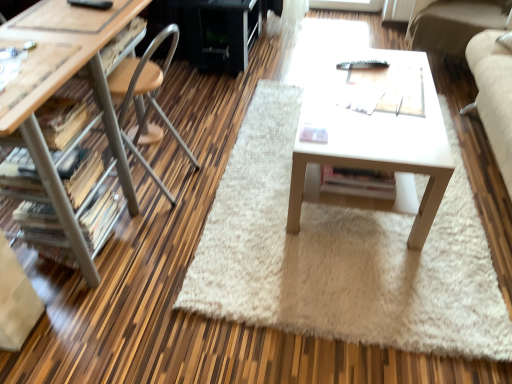
Question: Considering the relative positions of wooden drawer at left and white shaggy rug at center in the image provided, is wooden drawer at left behind white shaggy rug at center?

Choices:
 (A) yes
 (B) no

Answer: (A)

Question: Would you consider wooden drawer at left to be distant from white shaggy rug at center?

Choices:
 (A) yes
 (B) no

Answer: (A)

Question: Considering the relative sizes of wooden drawer at left and white shaggy rug at center in the image provided, is wooden drawer at left wider than white shaggy rug at center?

Choices:
 (A) no
 (B) yes

Answer: (A)

Question: From a real-world perspective, is wooden drawer at left under white shaggy rug at center?

Choices:
 (A) no
 (B) yes

Answer: (A)

Question: Considering the relative sizes of wooden drawer at left and white shaggy rug at center in the image provided, is wooden drawer at left smaller than white shaggy rug at center?

Choices:
 (A) no
 (B) yes

Answer: (B)

Question: From a real-world perspective, is white matte table at center positioned above or below white shaggy rug at center?

Choices:
 (A) above
 (B) below

Answer: (A)

Question: From the image's perspective, is white matte table at center above or below white shaggy rug at center?

Choices:
 (A) below
 (B) above

Answer: (B)

Question: In terms of height, does white matte table at center look taller or shorter compared to white shaggy rug at center?

Choices:
 (A) tall
 (B) short

Answer: (A)

Question: Considering the positions of white matte table at center and white shaggy rug at center in the image, is white matte table at center wider or thinner than white shaggy rug at center?

Choices:
 (A) wide
 (B) thin

Answer: (B)

Question: Is point (258, 31) closer or farther from the camera than point (141, 26)?

Choices:
 (A) farther
 (B) closer

Answer: (A)

Question: From the image's perspective, is black glossy entertainment center at upper center located above or below wooden drawer at left?

Choices:
 (A) below
 (B) above

Answer: (B)

Question: Is black glossy entertainment center at upper center in front of or behind wooden drawer at left in the image?

Choices:
 (A) front
 (B) behind

Answer: (B)

Question: Looking at the image, does black glossy entertainment center at upper center seem bigger or smaller compared to wooden drawer at left?

Choices:
 (A) big
 (B) small

Answer: (A)

Question: Considering the positions of white shaggy rug at center and matte wood desk at left in the image, is white shaggy rug at center taller or shorter than matte wood desk at left?

Choices:
 (A) short
 (B) tall

Answer: (A)

Question: Looking at their shapes, would you say white shaggy rug at center is wider or thinner than matte wood desk at left?

Choices:
 (A) thin
 (B) wide

Answer: (B)